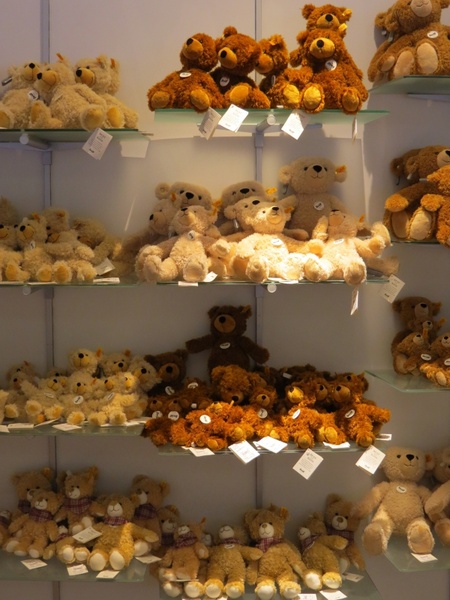
The height and width of the screenshot is (600, 450). Identify the location of wall. (421, 410).